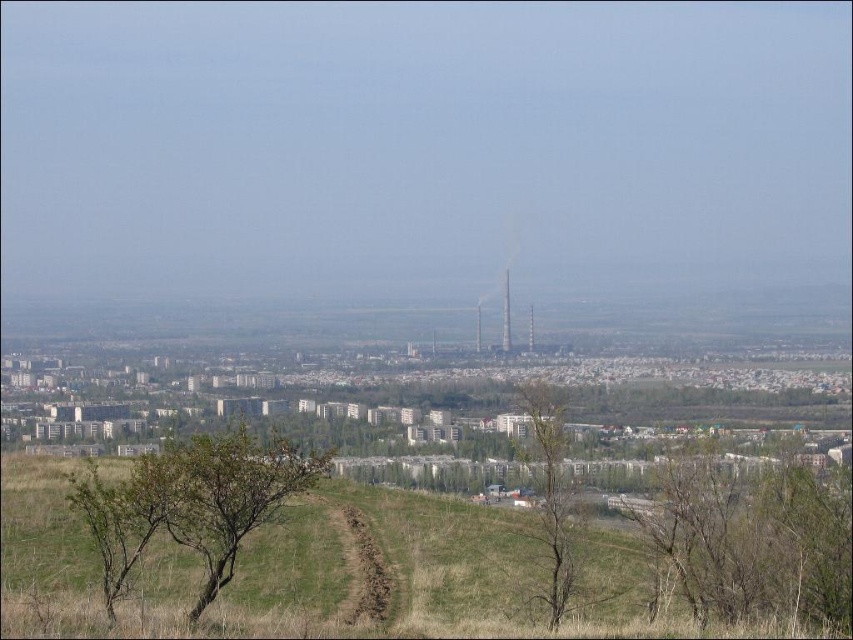
Question: Is green leafy tree at left wider than green leafy tree at center?

Choices:
 (A) no
 (B) yes

Answer: (B)

Question: In this image, where is brown leafless tree at lower right located relative to green leafy tree at left?

Choices:
 (A) right
 (B) left

Answer: (A)

Question: Which point appears farthest from the camera in this image?

Choices:
 (A) (548, 429)
 (B) (68, 497)

Answer: (A)

Question: Which of the following is the farthest from the observer?

Choices:
 (A) green leafy tree at center
 (B) green leafy tree at left
 (C) brown leafless tree at lower right

Answer: (A)

Question: Which point is closer to the camera?

Choices:
 (A) green leafy tree at left
 (B) brown leafless tree at lower right

Answer: (A)

Question: Can you confirm if brown leafless tree at lower right is positioned to the left of green leafy tree at left?

Choices:
 (A) no
 (B) yes

Answer: (A)